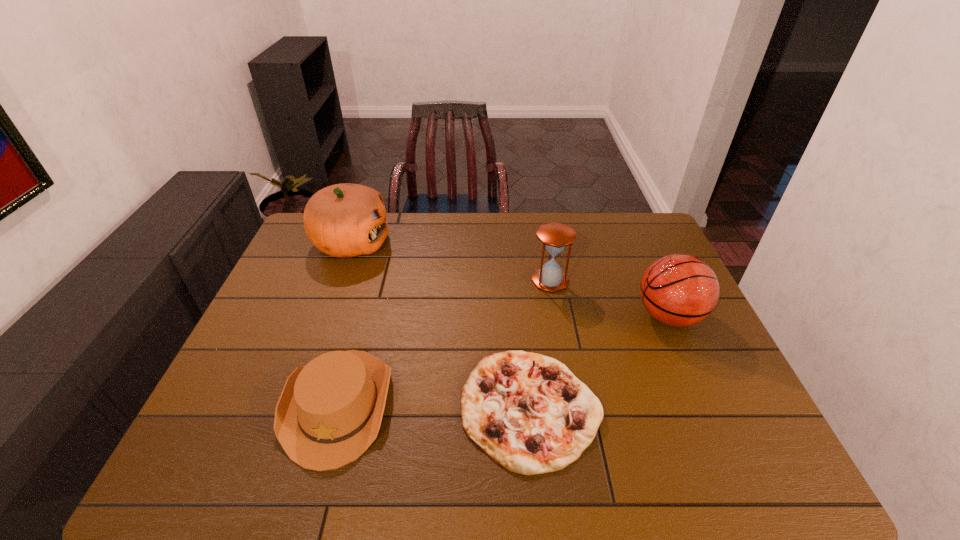
This screenshot has width=960, height=540. In order to click on free space at the right edge of the desktop in this screenshot , I will do `click(759, 430)`.

Locate an element on the screen. vacant space at the near left corner of the desktop is located at coordinates (242, 483).

This screenshot has height=540, width=960. Find the location of `free point at the far right corner`. free point at the far right corner is located at coordinates (640, 233).

This screenshot has height=540, width=960. I want to click on vacant area that lies between the hourglass and the pumpkin, so click(x=451, y=262).

You are a GUI agent. You are given a task and a screenshot of the screen. Output one action in this format:
    pyautogui.click(x=<x>, y=<y>)
    Task: Click on the vacant space in between the fourth tallest object and the farthest object
    Image resolution: width=960 pixels, height=540 pixels.
    Given the screenshot: What is the action you would take?
    pyautogui.click(x=345, y=323)

Find the location of a particular element. The image size is (960, 540). vacant space that is in between the pizza and the hourglass is located at coordinates (540, 344).

The image size is (960, 540). What are the coordinates of `free point between the hourglass and the basketball` in the screenshot? It's located at (610, 298).

What are the coordinates of `free space between the basketball and the pizza` in the screenshot? It's located at (599, 362).

At what (x,y) coordinates should I click in order to perform the action: click on empty space between the farthest object and the rightmost object. Please return your answer as a coordinate pair (x, y). This screenshot has width=960, height=540. Looking at the image, I should click on (510, 279).

Locate an element on the screen. empty space between the farthest object and the hourglass is located at coordinates (451, 262).